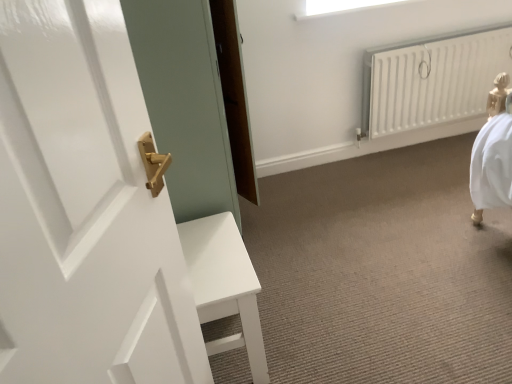
Identify the location of white matte radiator at upper right. The width and height of the screenshot is (512, 384). (432, 79).

What do you see at coordinates (432, 79) in the screenshot?
I see `white matte radiator at upper right` at bounding box center [432, 79].

The height and width of the screenshot is (384, 512). I want to click on white glossy door handle at upper left, so click(x=84, y=210).

The height and width of the screenshot is (384, 512). What do you see at coordinates (84, 210) in the screenshot?
I see `white glossy door handle at upper left` at bounding box center [84, 210].

Locate an element on the screen. The width and height of the screenshot is (512, 384). white matte radiator at upper right is located at coordinates (432, 79).

In the scene shown: Based on their positions, is white matte radiator at upper right located to the left or right of white glossy door handle at upper left?

From the image, it's evident that white matte radiator at upper right is to the right of white glossy door handle at upper left.

Does white matte radiator at upper right come in front of white glossy door handle at upper left?

No.

Which point is more distant from viewer, (425, 53) or (109, 233)?

The point (425, 53) is farther from the camera.

From the image's perspective, does white matte radiator at upper right appear higher than white glossy door handle at upper left?

Correct, white matte radiator at upper right appears higher than white glossy door handle at upper left in the image.

From a real-world perspective, is white matte radiator at upper right on white glossy door handle at upper left?

No.

Which of these two, white matte radiator at upper right or white glossy door handle at upper left, is thinner?

white glossy door handle at upper left is thinner.

Is white matte radiator at upper right taller or shorter than white glossy door handle at upper left?

white matte radiator at upper right is shorter than white glossy door handle at upper left.

Who is bigger, white matte radiator at upper right or white glossy door handle at upper left?

With larger size is white matte radiator at upper right.

Is white matte radiator at upper right positioned beyond the bounds of white glossy door handle at upper left?

Yes, white matte radiator at upper right is located beyond the bounds of white glossy door handle at upper left.

Is white matte radiator at upper right far from white glossy door handle at upper left?

white matte radiator at upper right is far away from white glossy door handle at upper left.

Could you tell me if white matte radiator at upper right is turned towards white glossy door handle at upper left?

No, white matte radiator at upper right is not turned towards white glossy door handle at upper left.

Locate an element on the screen. This screenshot has height=384, width=512. radiator behind the white glossy door handle at upper left is located at coordinates (432, 79).

In the image, is white glossy door handle at upper left on the left side or the right side of white matte radiator at upper right?

Clearly, white glossy door handle at upper left is on the left of white matte radiator at upper right in the image.

Does white glossy door handle at upper left lie in front of white matte radiator at upper right?

Yes, white glossy door handle at upper left is closer to the camera.

Does point (53, 149) appear closer or farther from the camera than point (494, 36)?

Point (53, 149) is closer to the camera than point (494, 36).

From the image's perspective, which object appears higher, white glossy door handle at upper left or white matte radiator at upper right?

white matte radiator at upper right appears higher in the image.

From a real-world perspective, which is physically below, white glossy door handle at upper left or white matte radiator at upper right?

white matte radiator at upper right, from a real-world perspective.

Does white glossy door handle at upper left have a lesser width compared to white matte radiator at upper right?

Correct, the width of white glossy door handle at upper left is less than that of white matte radiator at upper right.

In the scene shown: Considering the sizes of white glossy door handle at upper left and white matte radiator at upper right in the image, is white glossy door handle at upper left taller or shorter than white matte radiator at upper right?

white glossy door handle at upper left is taller than white matte radiator at upper right.

Does white glossy door handle at upper left have a smaller size compared to white matte radiator at upper right?

Yes.

Could white matte radiator at upper right be considered to be inside white glossy door handle at upper left?

No, white matte radiator at upper right is not a part of white glossy door handle at upper left.

Are white glossy door handle at upper left and white matte radiator at upper right beside each other?

They are not placed beside each other.

Could you tell me if white glossy door handle at upper left is turned towards white matte radiator at upper right?

No, white glossy door handle at upper left is not facing towards white matte radiator at upper right.

What's the angular difference between white glossy door handle at upper left and white matte radiator at upper right's facing directions?

They differ by 67.2 degrees in their facing directions.

What are the coordinates of `radiator above the white glossy door handle at upper left (from the image's perspective)` in the screenshot? It's located at click(x=432, y=79).

Where is `radiator behind the white glossy door handle at upper left`? Image resolution: width=512 pixels, height=384 pixels. radiator behind the white glossy door handle at upper left is located at coordinates (432, 79).

Locate an element on the screen. Image resolution: width=512 pixels, height=384 pixels. door in front of the white matte radiator at upper right is located at coordinates (84, 210).